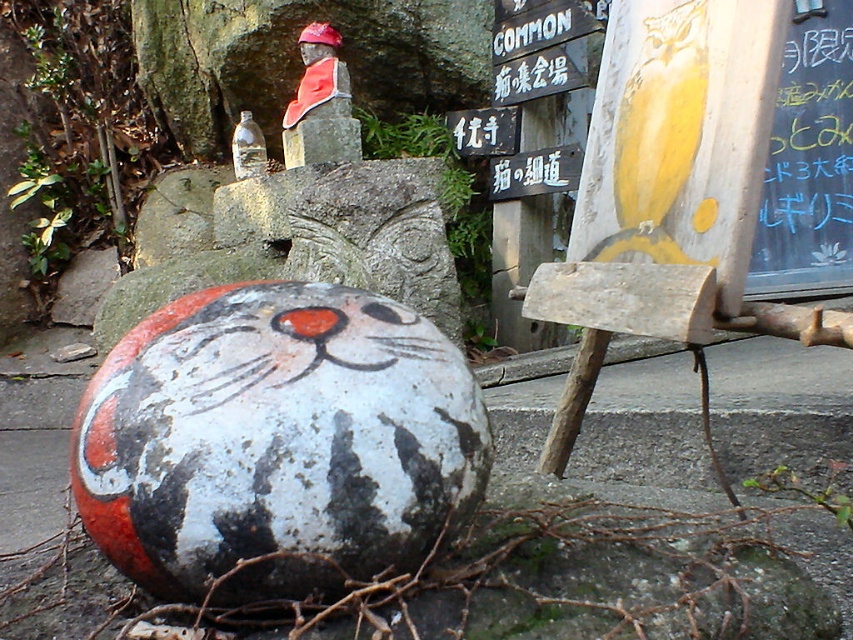
Who is positioned more to the left, wooden signboard at upper center or metallic signboard at center?

metallic signboard at center

Between wooden signboard at upper center and metallic signboard at center, which one appears on the right side from the viewer's perspective?

Positioned to the right is wooden signboard at upper center.

This screenshot has width=853, height=640. Describe the element at coordinates (541, 74) in the screenshot. I see `wooden signboard at upper center` at that location.

At what (x,y) coordinates should I click in order to perform the action: click on wooden signboard at upper center. Please return your answer as a coordinate pair (x, y). Image resolution: width=853 pixels, height=640 pixels. Looking at the image, I should click on (541, 74).

Does painted stone cat at lower left have a greater height compared to wooden signboard at upper center?

Yes.

Does painted stone cat at lower left appear on the right side of wooden signboard at upper center?

No, painted stone cat at lower left is not to the right of wooden signboard at upper center.

Which is behind, point (187, 586) or point (572, 38)?

Positioned behind is point (572, 38).

Find the location of a particular element. Image resolution: width=853 pixels, height=640 pixels. painted stone cat at lower left is located at coordinates (276, 442).

Is painted stone cat at lower left wider than metallic signboard at center?

Yes, painted stone cat at lower left is wider than metallic signboard at center.

Identify the location of painted stone cat at lower left. (276, 442).

You are a GUI agent. You are given a task and a screenshot of the screen. Output one action in this format:
    pyautogui.click(x=<x>, y=<y>)
    Task: Click on the painted stone cat at lower left
    The width and height of the screenshot is (853, 640).
    Given the screenshot: What is the action you would take?
    pyautogui.click(x=276, y=442)